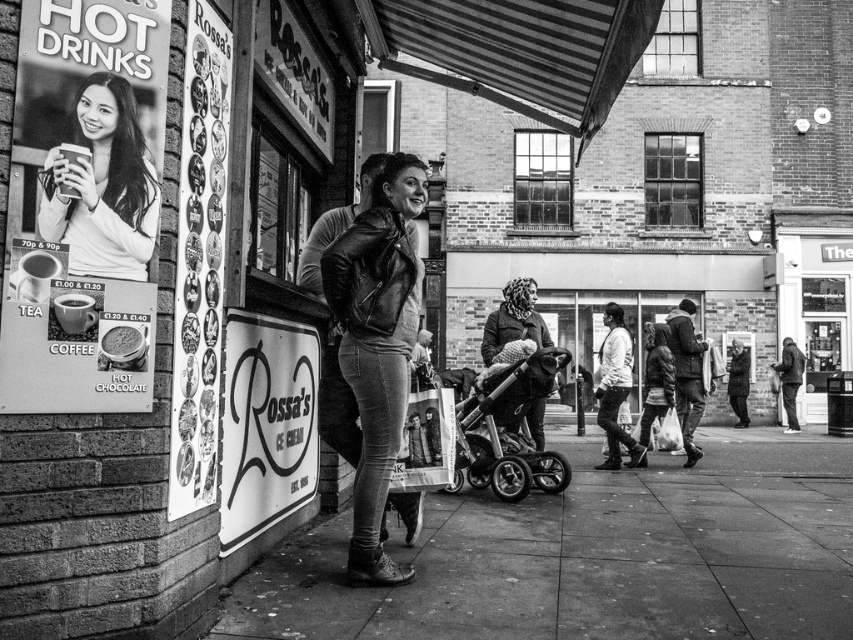
Question: Which object is farther from the camera taking this photo?

Choices:
 (A) light gray jacket at center
 (B) knitted woolen scarf at center
 (C) smooth paper poster at upper left

Answer: (A)

Question: Does matte plastic cup at upper left have a lesser width compared to dark fabric coat at right?

Choices:
 (A) yes
 (B) no

Answer: (A)

Question: Does smooth paper poster at upper left have a larger size compared to knitted woolen scarf at center?

Choices:
 (A) no
 (B) yes

Answer: (B)

Question: Which point is farther to the camera?

Choices:
 (A) (782, 406)
 (B) (740, 394)
 (C) (28, 250)

Answer: (A)

Question: Does leather jacket at center have a greater width compared to dark fabric coat at right?

Choices:
 (A) yes
 (B) no

Answer: (B)

Question: Which of these objects is positioned farthest from the knitted woolen scarf at center?

Choices:
 (A) matte plastic cup at upper left
 (B) leather jacket at center
 (C) smooth concrete pavement at lower center

Answer: (A)